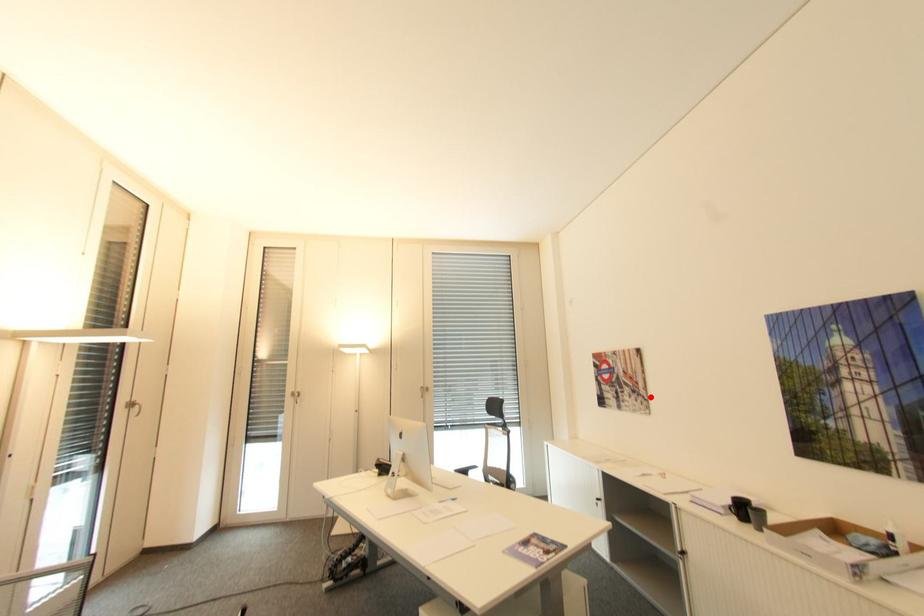
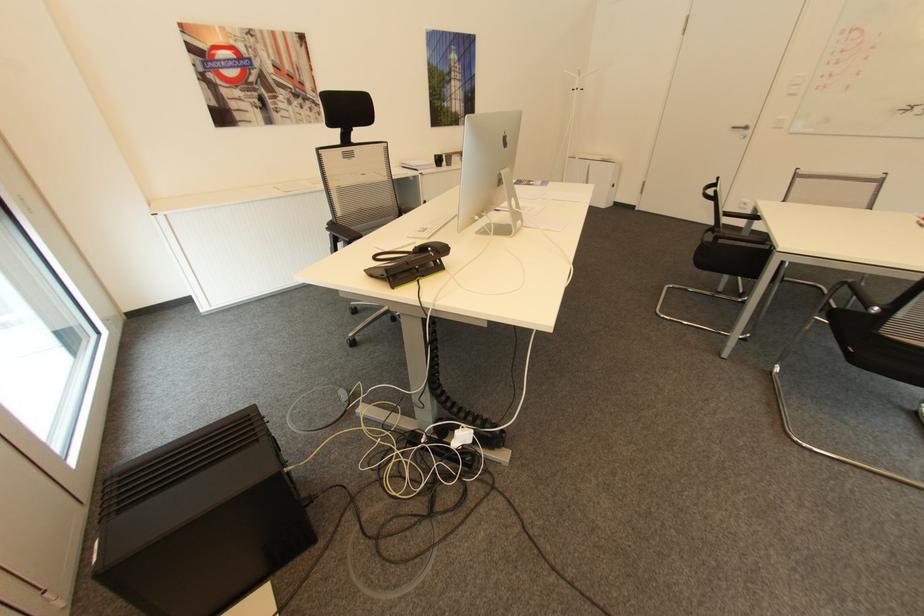
Where in the second image is the point corresponding to the highlighted location from the first image?

(322, 102)